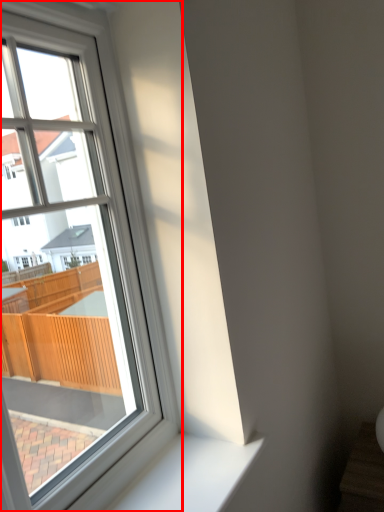
Question: From the image's perspective, considering the relative positions of window (annotated by the red box) and window sill in the image provided, where is window (annotated by the red box) located with respect to the staircase?

Choices:
 (A) above
 (B) below

Answer: (A)